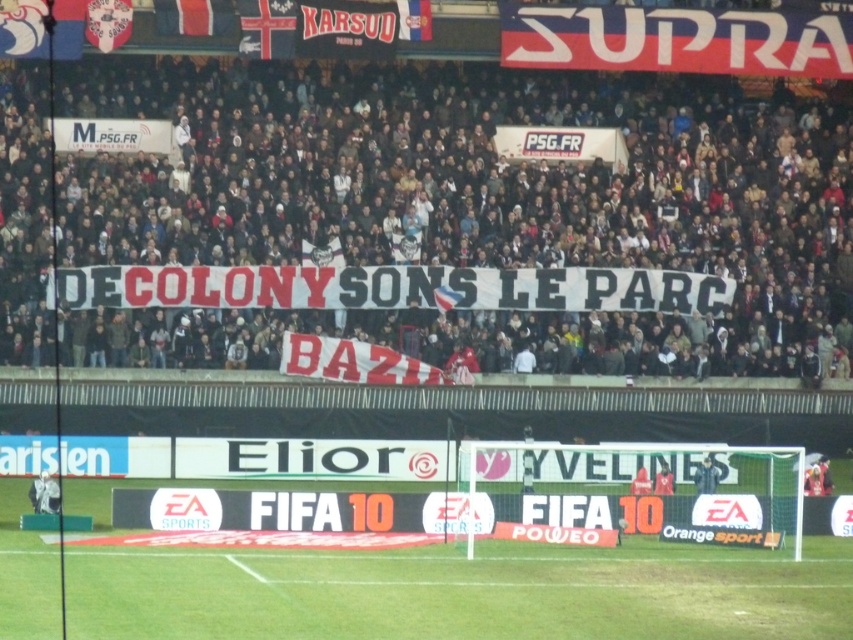
The width and height of the screenshot is (853, 640). I want to click on white fabric banner at center, so click(x=459, y=225).

Does white fabric banner at center appear over green grass at lower center?

Correct, white fabric banner at center is located above green grass at lower center.

Image resolution: width=853 pixels, height=640 pixels. Find the location of `white fabric banner at center`. white fabric banner at center is located at coordinates (459, 225).